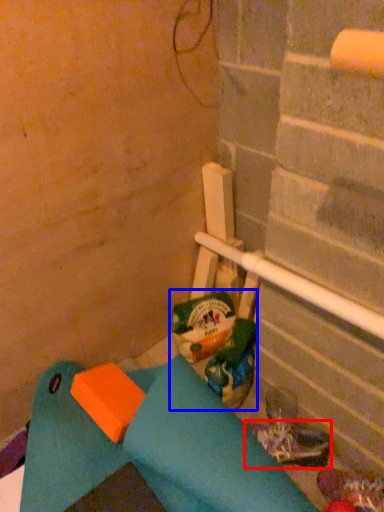
Question: Which object is closer to the camera taking this photo, footwear (highlighted by a red box) or garbage (highlighted by a blue box)?

Choices:
 (A) footwear
 (B) garbage

Answer: (A)